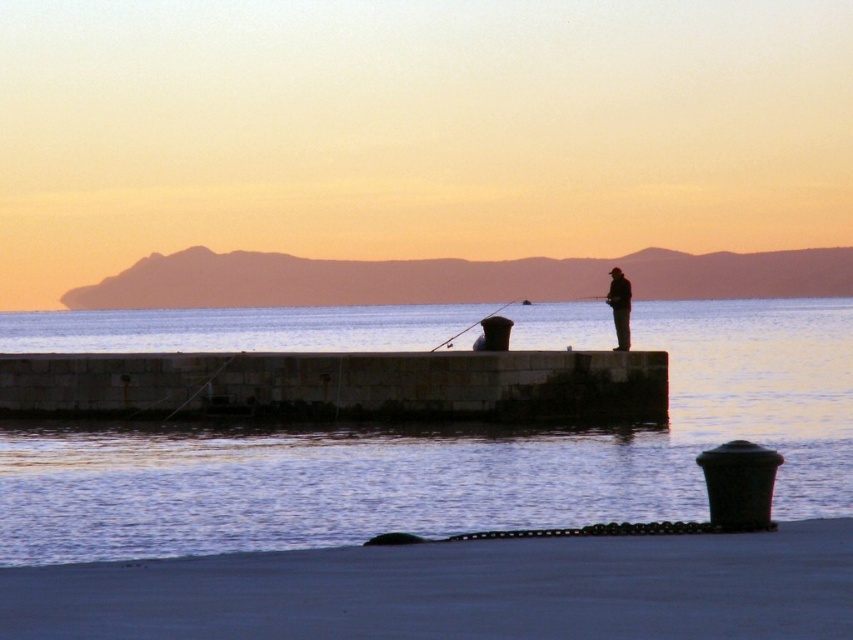
You are a photographer trying to capture the silhouette figure at center and the smooth water at center in a single shot. Based on their relative sizes in the image, which object appears larger?

The smooth water at center appears larger because it is taller than the silhouette figure at center.